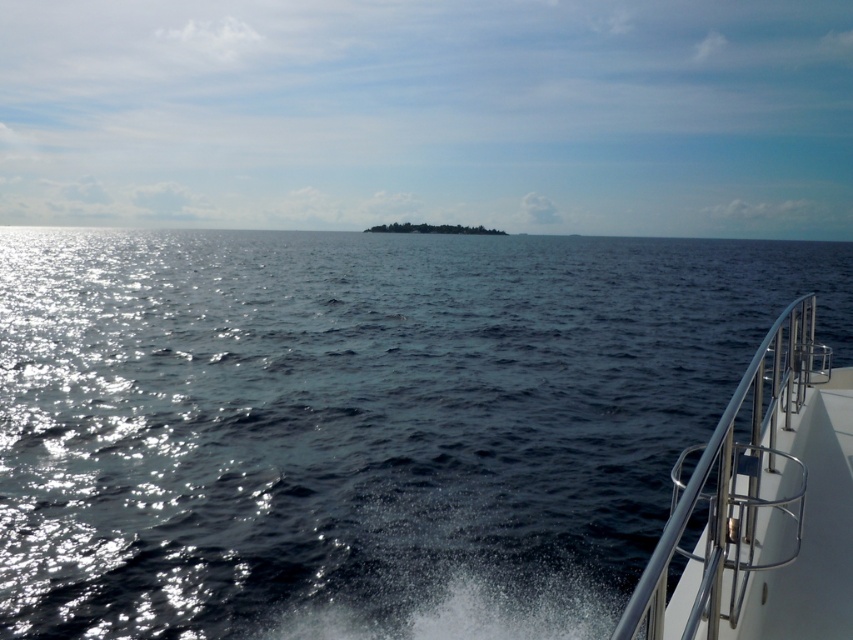
Can you confirm if glistening blue water at center is bigger than white metallic railing at right?

Yes.

Which is behind, point (404, 564) or point (722, 573)?

Point (404, 564)

Who is more forward, (x=395, y=324) or (x=805, y=454)?

Positioned in front is point (x=805, y=454).

At what (x,y) coordinates should I click in order to perform the action: click on glistening blue water at center. Please return your answer as a coordinate pair (x, y). Looking at the image, I should click on (361, 422).